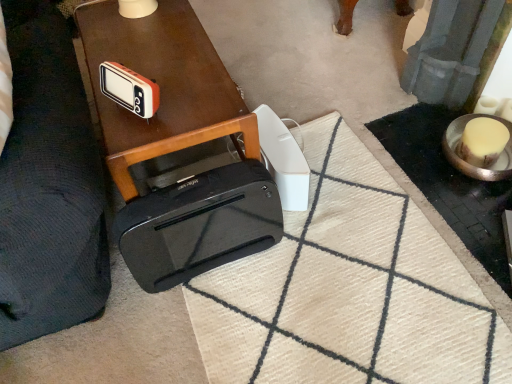
This screenshot has height=384, width=512. Identify the location of free space in front of orange plastic radio at upper left, placed as the second gadget when sorted from right to left. 131,142.